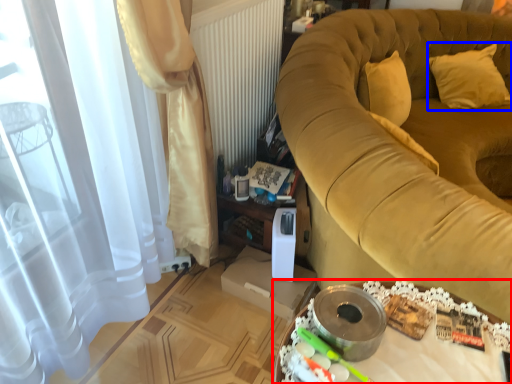
Question: Among these objects, which one is farthest to the camera, table (highlighted by a red box) or pillow (highlighted by a blue box)?

Choices:
 (A) table
 (B) pillow

Answer: (B)